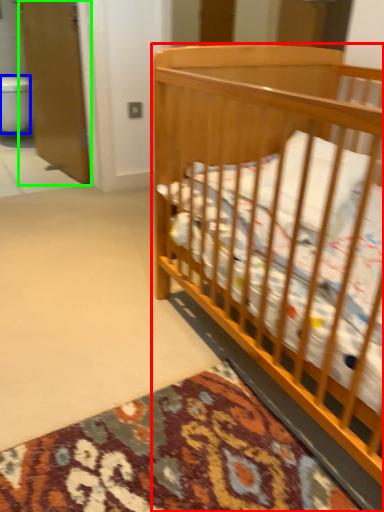
Question: Estimate the real-world distances between objects in this image. Which object is closer to infant bed (highlighted by a red box), toilet bowl (highlighted by a blue box) or screen door (highlighted by a green box)?

Choices:
 (A) toilet bowl
 (B) screen door

Answer: (B)